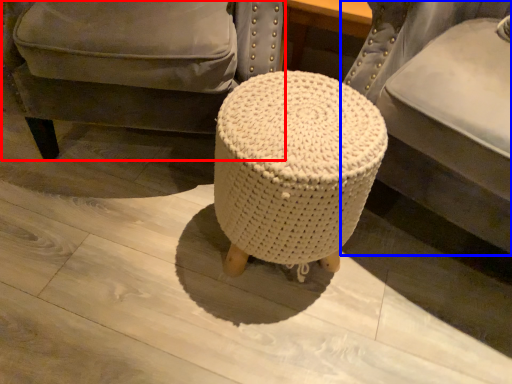
Question: Which point is further to the camera, chair (highlighted by a red box) or furniture (highlighted by a blue box)?

Choices:
 (A) chair
 (B) furniture

Answer: (A)